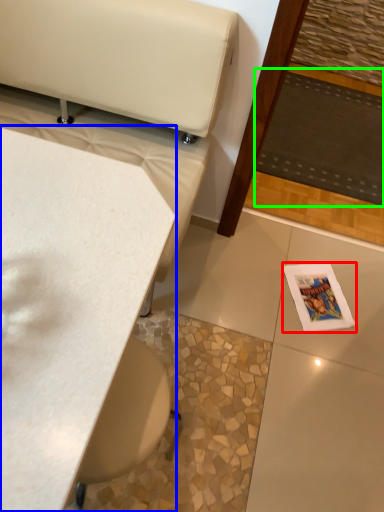
Question: Estimate the real-world distances between objects in this image. Which object is farther from magazine (highlighted by a red box), table (highlighted by a blue box) or mat (highlighted by a green box)?

Choices:
 (A) table
 (B) mat

Answer: (A)